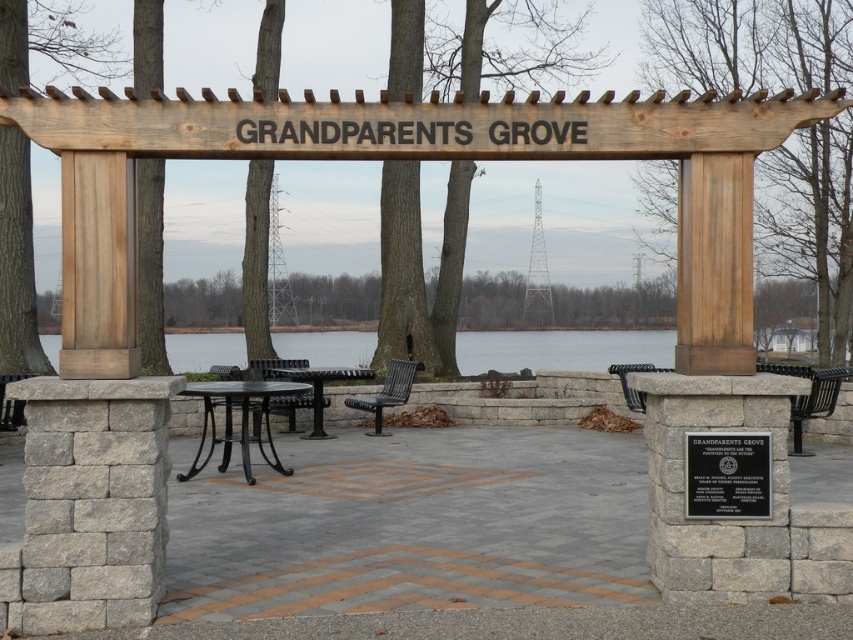
You are standing at the entrance of GRANDPARENTS GROVE and see the clear water at center and the black polished stone plaque at center. Which object is closer to the ground?

The black polished stone plaque at center is closer to the ground because the clear water at center is above it.

You are a visitor standing at the entrance of GRANDPARENTS GROVE. You see the clear water at center and the black polished stone plaque at center. Which object is farther away from you?

The clear water at center is farther away from you since it is 19.14 meters away from the black polished stone plaque at center, which is likely closer to the entrance.

You are standing at the entrance of GRANDPARENTS GROVE and want to touch both the black polished stone plaque at center and the metallic black picnic table at center. Which object should you reach for first based on their distances from you?

The black polished stone plaque at center is closer to the viewer than the metallic black picnic table at center, so you should reach for the black polished stone plaque at center first.